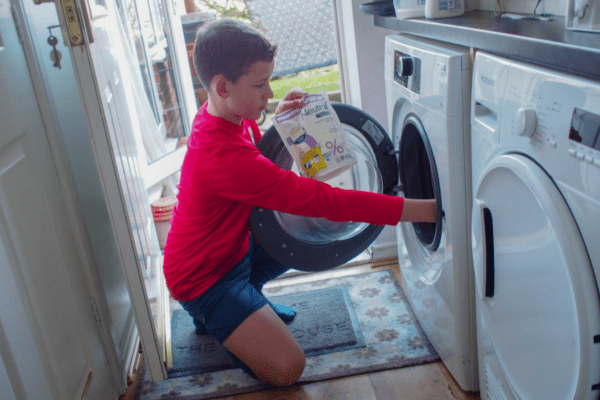
Identify the location of washer. This screenshot has height=400, width=600. (434, 106).